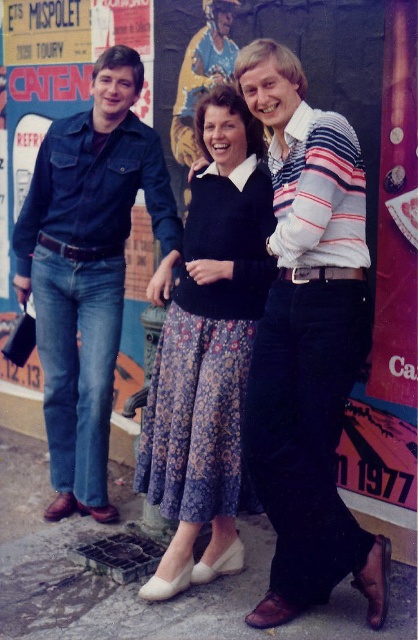
Between striped cotton shirt at center and denim jeans at left, which one is positioned lower?

Positioned lower is striped cotton shirt at center.

Is point (269, 76) closer to camera compared to point (91, 186)?

Yes, point (269, 76) is closer to viewer.

Does point (290, 588) lie behind point (61, 276)?

No, it is not.

This screenshot has width=418, height=640. I want to click on striped cotton shirt at center, so click(308, 344).

Who is more forward, (22, 304) or (211, 296)?

Point (211, 296) is in front.

Who is lower down, denim jeans at left or floral cotton dress at center?

Positioned lower is floral cotton dress at center.

Find the location of a particular element. denim jeans at left is located at coordinates 88,268.

Who is positioned more to the right, striped cotton shirt at center or floral cotton dress at center?

Positioned to the right is striped cotton shirt at center.

Looking at this image, which of these two, striped cotton shirt at center or floral cotton dress at center, stands shorter?

Standing shorter between the two is floral cotton dress at center.

Who is more distant from viewer, (351, 148) or (209, 333)?

Positioned behind is point (209, 333).

This screenshot has height=640, width=418. I want to click on striped cotton shirt at center, so click(x=308, y=344).